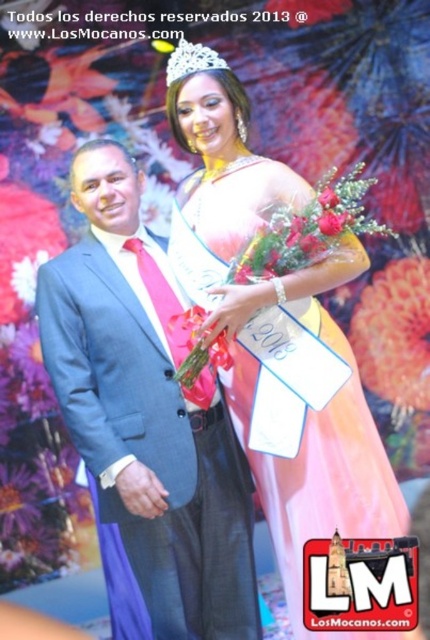
Question: Among these objects, which one is nearest to the camera?

Choices:
 (A) clear crystal tiara at upper center
 (B) pink satin dress at center
 (C) blue suit at center

Answer: (B)

Question: Does blue suit at center lie behind clear crystal tiara at upper center?

Choices:
 (A) no
 (B) yes

Answer: (A)

Question: Does blue suit at center appear over clear crystal tiara at upper center?

Choices:
 (A) yes
 (B) no

Answer: (B)

Question: Which point is closer to the camera?

Choices:
 (A) (95, 289)
 (B) (206, 204)
 (C) (187, 49)

Answer: (C)

Question: Among these objects, which one is farthest from the camera?

Choices:
 (A) clear crystal tiara at upper center
 (B) blue suit at center
 (C) pink satin dress at center

Answer: (A)

Question: Is blue suit at center positioned before clear crystal tiara at upper center?

Choices:
 (A) no
 (B) yes

Answer: (B)